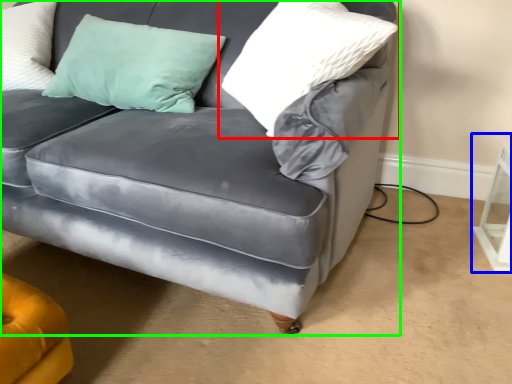
Question: Estimate the real-world distances between objects in this image. Which object is closer to pillow (highlighted by a red box), table (highlighted by a blue box) or studio couch (highlighted by a green box)?

Choices:
 (A) table
 (B) studio couch

Answer: (B)